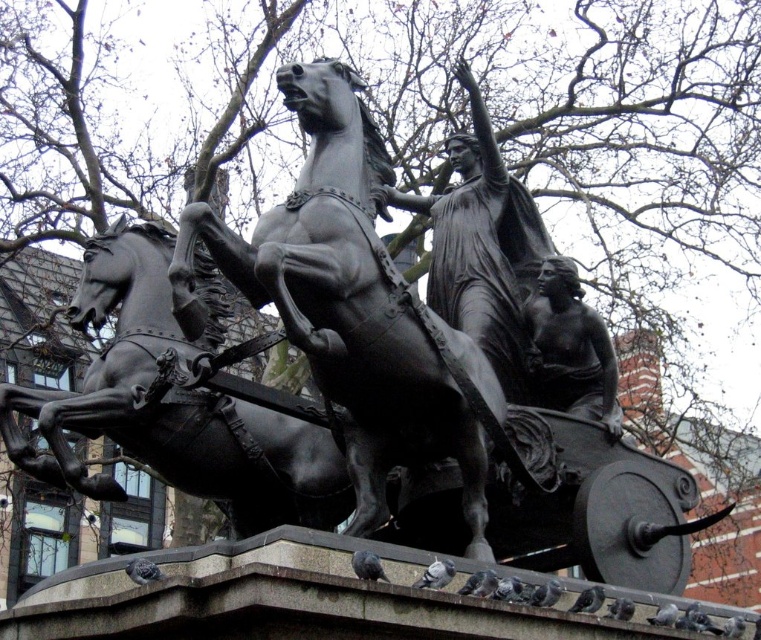
Is polished bronze horse at center smaller than polished bronze statue at center?

No, polished bronze horse at center is not smaller than polished bronze statue at center.

Which is more to the right, polished bronze horse at center or polished bronze statue at center?

Positioned to the right is polished bronze statue at center.

Is point (247, 536) in front of point (457, 212)?

Yes, point (247, 536) is in front of point (457, 212).

The width and height of the screenshot is (761, 640). I want to click on polished bronze horse at center, so click(170, 406).

Does polished bronze chariot at center have a greater width compared to polished bronze horse at center?

Incorrect, polished bronze chariot at center's width does not surpass polished bronze horse at center's.

Who is lower down, polished bronze chariot at center or polished bronze horse at center?

polished bronze horse at center is below.

Which is behind, point (344, 116) or point (11, 444)?

Point (11, 444)

Find the location of a particular element. The image size is (761, 640). polished bronze chariot at center is located at coordinates (352, 307).

Between polished bronze chariot at center and bronze statue at center, which one has more height?

polished bronze chariot at center

Between point (330, 192) and point (540, 268), which one is positioned behind?

Positioned behind is point (540, 268).

Is point (193, 205) positioned before point (602, 371)?

That is True.

Identify the location of polished bronze chariot at center. (352, 307).